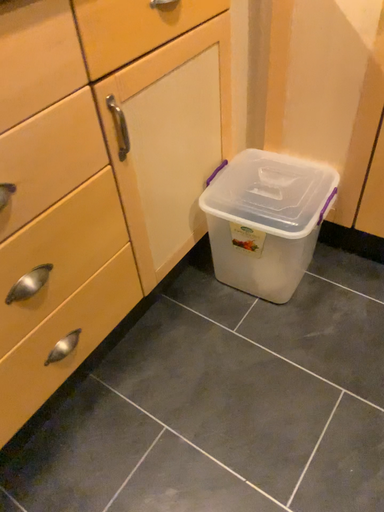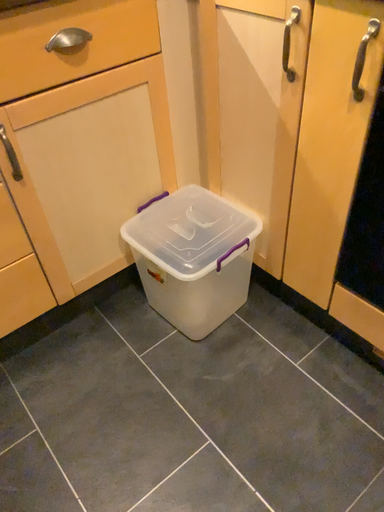
Question: Which way did the camera rotate in the video?

Choices:
 (A) rotated left
 (B) rotated right

Answer: (A)